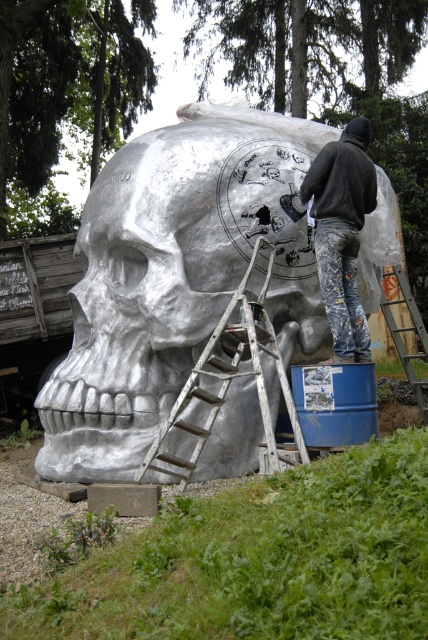
Consider the image. Can you confirm if brushed wood ladder at center is positioned to the left of brushed metal ladder at lower right?

Correct, you'll find brushed wood ladder at center to the left of brushed metal ladder at lower right.

Which is above, brushed wood ladder at center or brushed metal ladder at lower right?

Positioned higher is brushed metal ladder at lower right.

Measure the distance between point (255, 332) and camera.

The distance of point (255, 332) from camera is 18.40 feet.

What are the coordinates of `brushed wood ladder at center` in the screenshot? It's located at (231, 380).

Between brushed metal skull at center and brushed metal ladder at lower right, which one has less height?

With less height is brushed metal ladder at lower right.

Between brushed metal skull at center and brushed metal ladder at lower right, which one appears on the left side from the viewer's perspective?

Positioned to the left is brushed metal skull at center.

Is point (168, 285) behind point (389, 307)?

That is False.

In order to click on brushed metal skull at center in this screenshot , I will do `click(175, 276)`.

Can you confirm if brushed metal skull at center is taller than brushed wood ladder at center?

Yes, brushed metal skull at center is taller than brushed wood ladder at center.

Can you confirm if brushed metal skull at center is thinner than brushed wood ladder at center?

In fact, brushed metal skull at center might be wider than brushed wood ladder at center.

Where is `brushed metal skull at center`? This screenshot has height=640, width=428. brushed metal skull at center is located at coordinates (175, 276).

In order to click on brushed metal skull at center in this screenshot , I will do `click(175, 276)`.